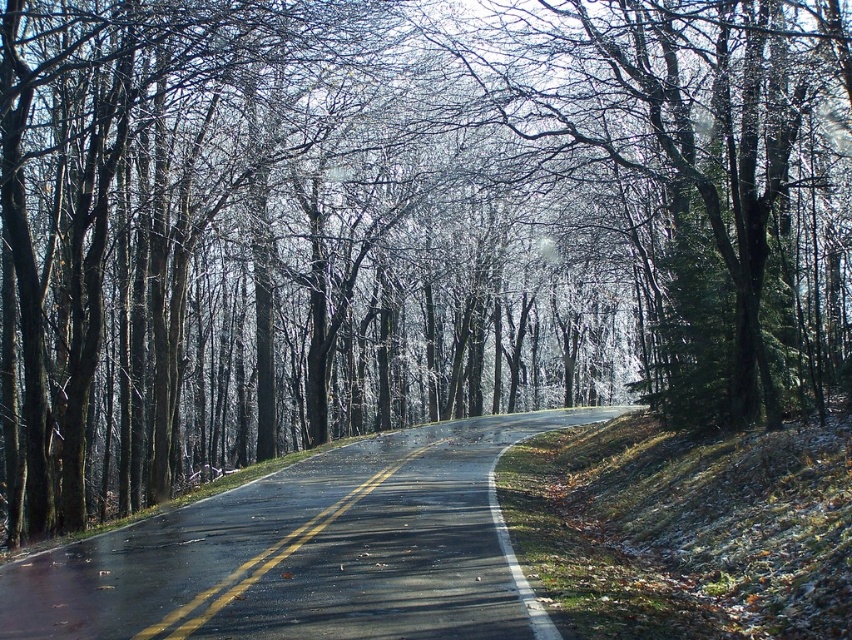
Can you confirm if glossy bark tree at center is wider than black asphalt road at center?

Correct, the width of glossy bark tree at center exceeds that of black asphalt road at center.

Between glossy bark tree at center and black asphalt road at center, which one is positioned lower?

Positioned lower is black asphalt road at center.

In the scene shown: Who is more distant from viewer, (648, 193) or (168, 625)?

Point (648, 193)

Image resolution: width=852 pixels, height=640 pixels. In order to click on glossy bark tree at center in this screenshot , I will do `click(698, 170)`.